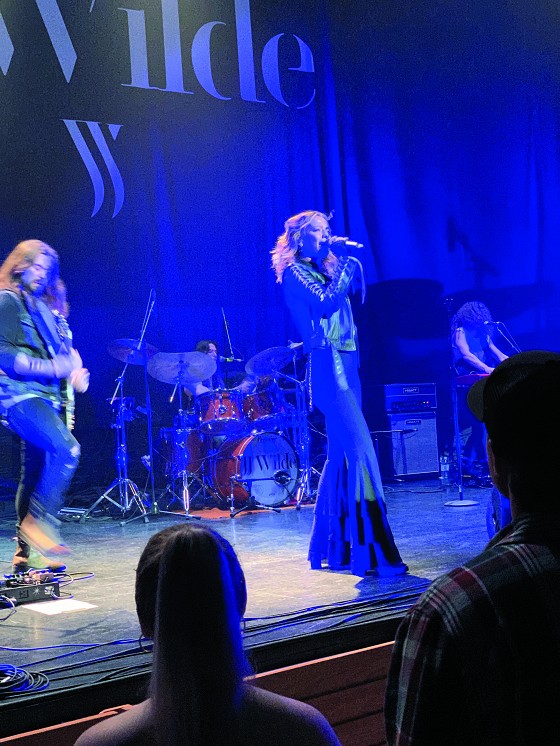
Find the location of a particular element. keyboard is located at coordinates (474, 379).